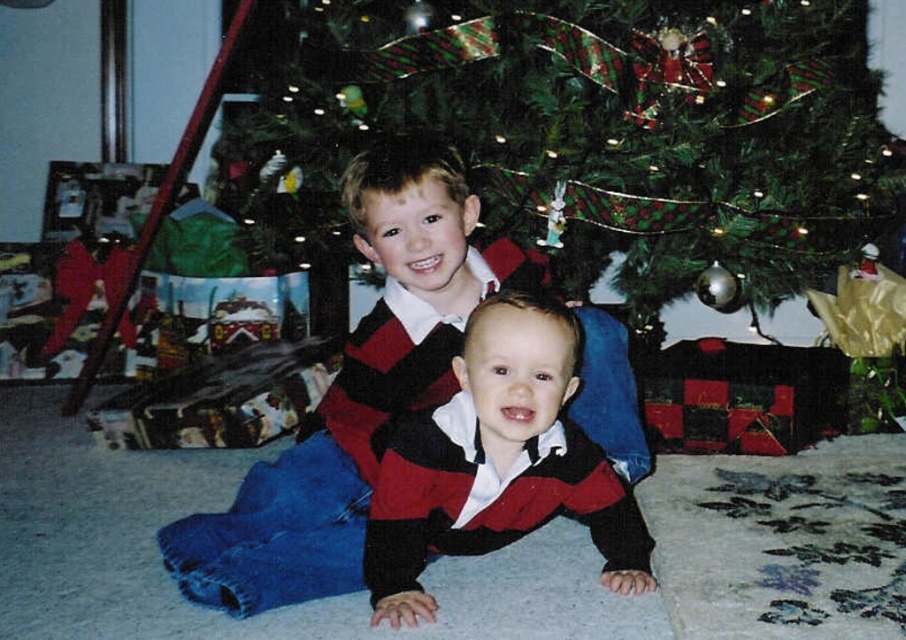
You are a photographer setting up for a family photo. You need to ensure that both the green textured christmas tree at upper center and the knit sweater at center are visible in the frame. Given their sizes, which object should you focus on to ensure both are in focus?

The green textured christmas tree at upper center is larger in size than the knit sweater at center, so focusing on the larger tree would help ensure both objects remain in focus as the sweater is smaller and closer to the camera.

You are a photographer setting up for a family photo. You notice two sweaters at the center of the scene. Which one is closer to the camera, the matte red sweater at center or the knit sweater at center?

The knit sweater at center is closer to the camera because the matte red sweater at center is below it, indicating it is positioned behind.